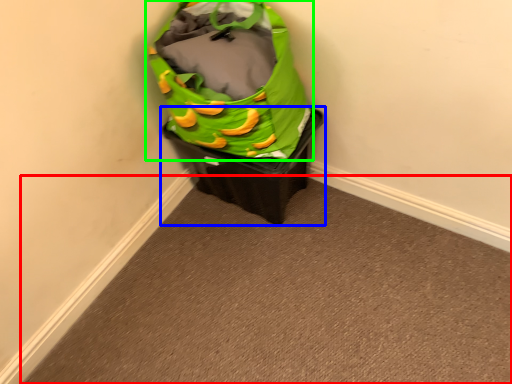
Question: Based on their relative distances, which object is farther from plain (highlighted by a red box)? Choose from waste container (highlighted by a blue box) and luggage and bags (highlighted by a green box).

Choices:
 (A) waste container
 (B) luggage and bags

Answer: (B)